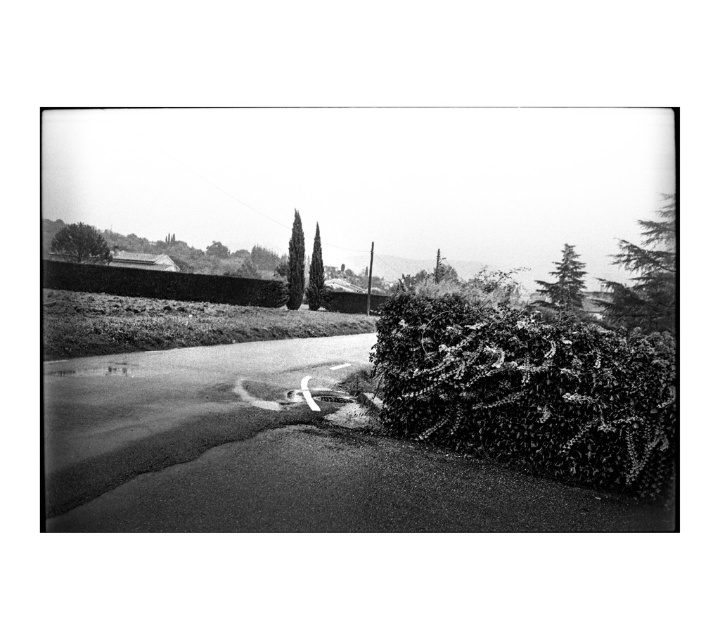
Is fuzzy green bush at right to the left of smooth green cypress at center from the viewer's perspective?

In fact, fuzzy green bush at right is to the right of smooth green cypress at center.

Can you confirm if fuzzy green bush at right is taller than smooth green cypress at center?

No.

Describe the element at coordinates (528, 388) in the screenshot. This screenshot has width=720, height=640. I see `fuzzy green bush at right` at that location.

Locate an element on the screen. The width and height of the screenshot is (720, 640). fuzzy green bush at right is located at coordinates (528, 388).

Which of these two, thick green hedge at center or green textured tree at upper right, stands taller?

green textured tree at upper right is taller.

Can you confirm if thick green hedge at center is thinner than green textured tree at upper right?

Yes.

Locate an element on the screen. This screenshot has height=640, width=720. thick green hedge at center is located at coordinates (162, 284).

Does thick green hedge at center appear under smooth green tree at upper left?

Yes.

How far apart are thick green hedge at center and smooth green tree at upper left?

thick green hedge at center is 26.22 meters away from smooth green tree at upper left.

Does point (269, 282) come in front of point (68, 250)?

Yes, point (269, 282) is in front of point (68, 250).

The image size is (720, 640). What are the coordinates of `thick green hedge at center` in the screenshot? It's located at (x=162, y=284).